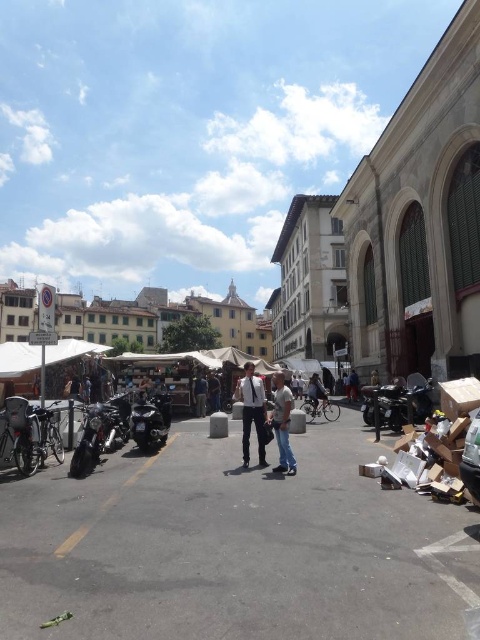
Can you confirm if shiny black motorcycle at right is positioned above light blue denim jeans at center?

Indeed, shiny black motorcycle at right is positioned over light blue denim jeans at center.

Which is in front, point (387, 394) or point (247, 362)?

Point (387, 394)

Is point (419, 378) farther from viewer compared to point (260, 419)?

Yes, it is.

Locate an element on the screen. The width and height of the screenshot is (480, 640). shiny black motorcycle at right is located at coordinates (405, 401).

Does shiny black motorcycle at center-left have a lesser width compared to dark blue jeans at center?

Incorrect, shiny black motorcycle at center-left's width is not less than dark blue jeans at center's.

The width and height of the screenshot is (480, 640). I want to click on shiny black motorcycle at center-left, so click(x=149, y=419).

Which is more to the right, denim jeans at center or dark blue jeans at center?

From the viewer's perspective, denim jeans at center appears more on the right side.

Is denim jeans at center smaller than dark blue jeans at center?

Indeed, denim jeans at center has a smaller size compared to dark blue jeans at center.

Locate an element on the screen. This screenshot has height=640, width=480. denim jeans at center is located at coordinates (282, 424).